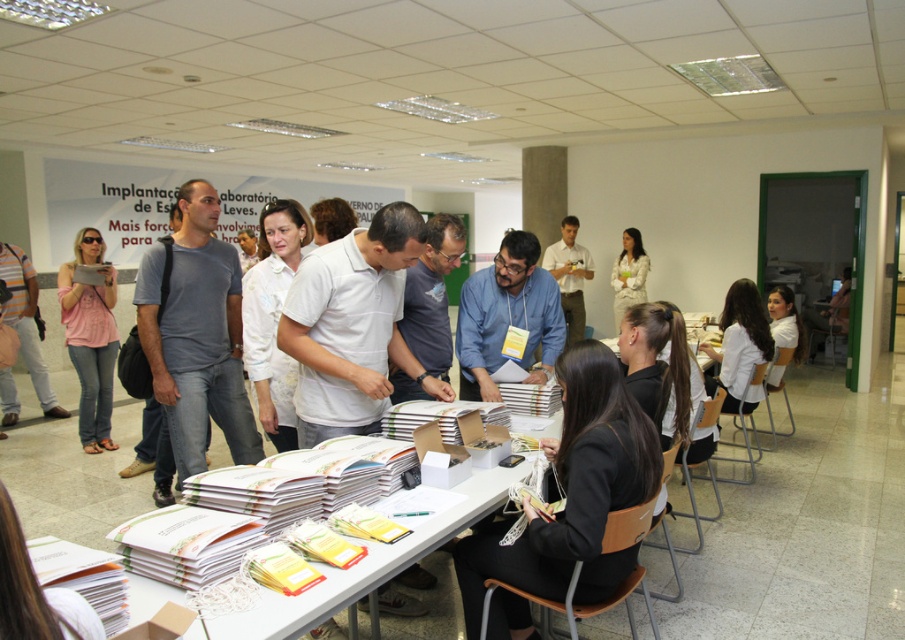
Is blue shirt at center positioned at the back of matte white shirt at center?

No.

Can you confirm if blue shirt at center is smaller than matte white shirt at center?

Correct, blue shirt at center occupies less space than matte white shirt at center.

This screenshot has height=640, width=905. I want to click on blue shirt at center, so click(x=507, y=316).

Which of these two, pink cotton shirt at center or white matte shirt at upper right, stands shorter?

white matte shirt at upper right

Describe the element at coordinates (90, 339) in the screenshot. This screenshot has height=640, width=905. I see `pink cotton shirt at center` at that location.

This screenshot has height=640, width=905. Describe the element at coordinates (90, 339) in the screenshot. I see `pink cotton shirt at center` at that location.

The image size is (905, 640). In order to click on pink cotton shirt at center in this screenshot , I will do `click(90, 339)`.

Who is lower down, white paper at center or pink cotton shirt at center?

white paper at center is lower down.

Which of these two, white paper at center or pink cotton shirt at center, stands taller?

pink cotton shirt at center

Which is in front, point (146, 492) or point (96, 259)?

Point (146, 492) is more forward.

Locate an element on the screen. white paper at center is located at coordinates (68, 484).